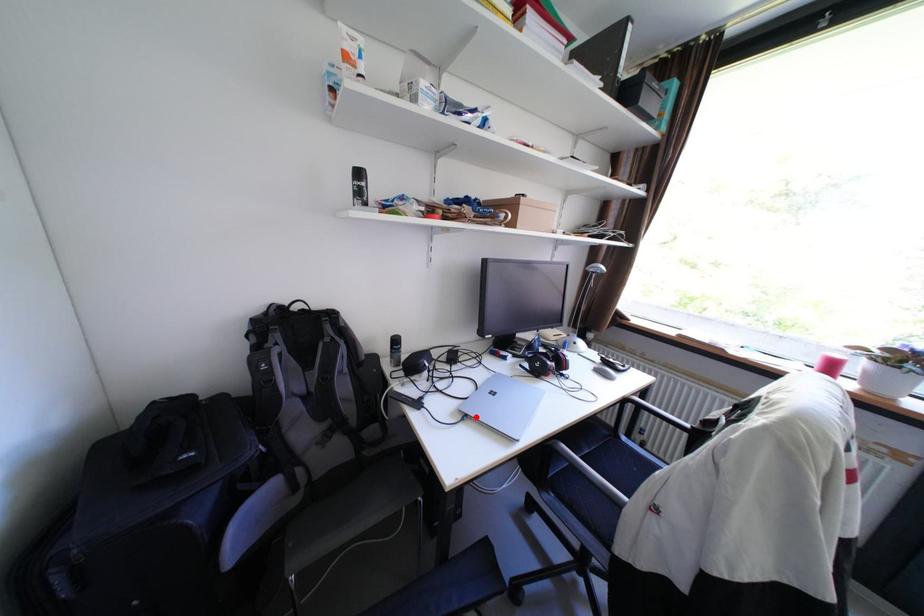
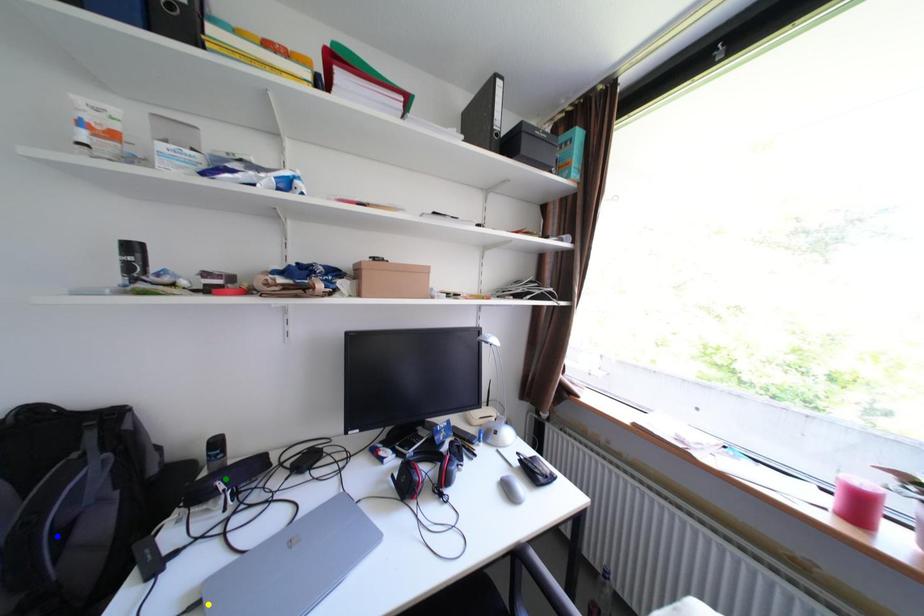
Question: I am providing you with two images of the same scene from different viewpoints. A red point is marked on the first image. You are given multiple points on the second image. Which point in image 2 represents the same 3d spot as the red point in image 1?

Choices:
 (A) yellow point
 (B) blue point
 (C) green point

Answer: (A)